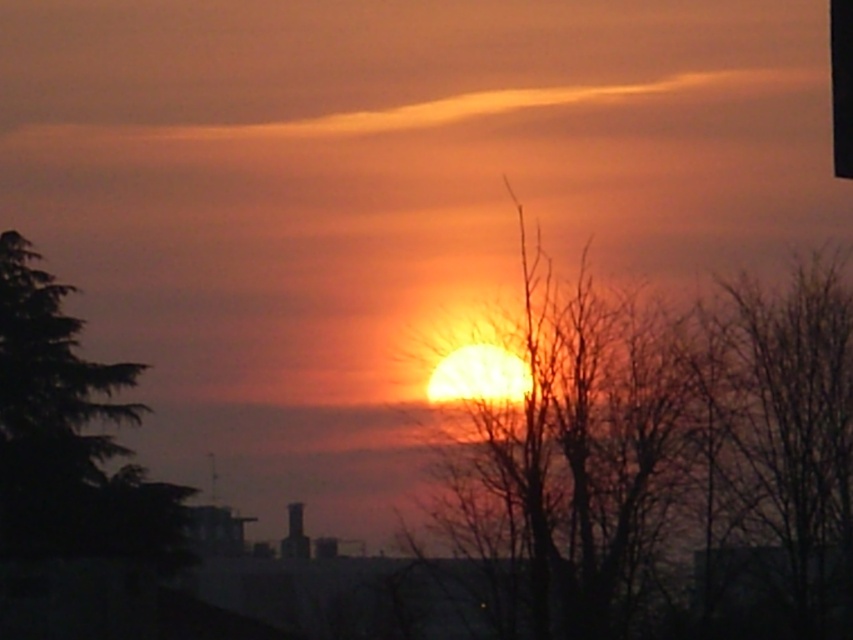
Does silhouette bare tree at center have a larger size compared to bare branches at right?

Correct, silhouette bare tree at center is larger in size than bare branches at right.

Between point (523, 436) and point (740, 408), which one is positioned in front?

Point (523, 436)

Which is behind, point (558, 316) or point (741, 566)?

The point (558, 316) is more distant.

Identify the location of silhouette bare tree at center. (573, 465).

Does green leafy tree at left appear on the left side of black plastic traffic light at upper right?

Correct, you'll find green leafy tree at left to the left of black plastic traffic light at upper right.

Does point (4, 368) come closer to viewer compared to point (842, 172)?

No, (4, 368) is behind (842, 172).

This screenshot has height=640, width=853. I want to click on green leafy tree at left, so click(x=68, y=472).

Identify the location of green leafy tree at left. (68, 472).

Does point (666, 321) lie in front of point (850, 177)?

No, it is not.

Is silhouette bare tree at center shorter than black plastic traffic light at upper right?

Incorrect, silhouette bare tree at center's height does not fall short of black plastic traffic light at upper right's.

Who is more forward, (668, 467) or (846, 20)?

Positioned in front is point (846, 20).

The width and height of the screenshot is (853, 640). Identify the location of silhouette bare tree at center. (573, 465).